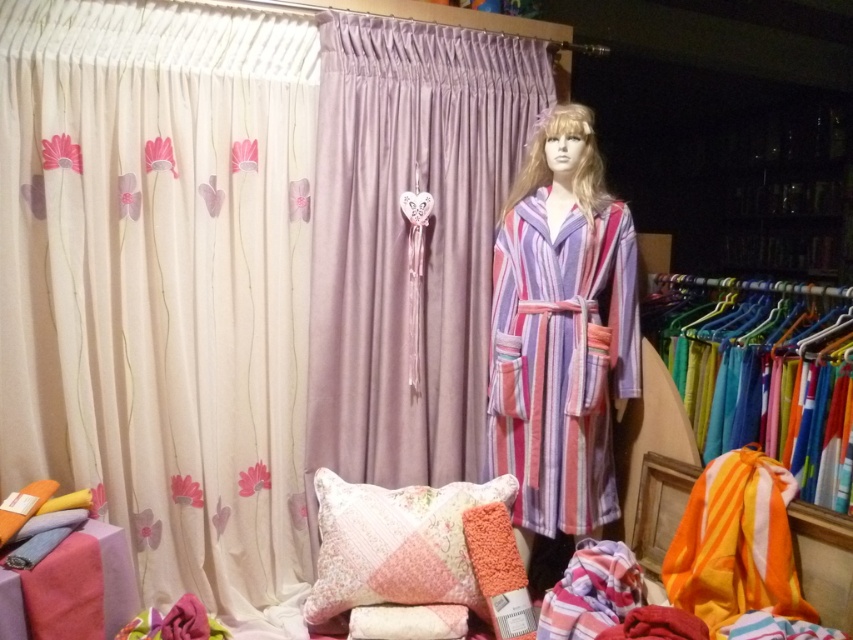
Describe the element at coordinates (407, 237) in the screenshot. Image resolution: width=853 pixels, height=640 pixels. I see `lavender satin curtain at center` at that location.

Is lavender satin curtain at center taller than fluffy pink pillow at center?

Yes, lavender satin curtain at center is taller than fluffy pink pillow at center.

Between point (436, 108) and point (456, 577), which one is positioned behind?

Point (436, 108)

I want to click on lavender satin curtain at center, so click(x=407, y=237).

Does creamy satin curtain at left have a lesser height compared to striped fabric robe at center?

Incorrect, creamy satin curtain at left's height does not fall short of striped fabric robe at center's.

Between creamy satin curtain at left and striped fabric robe at center, which one has more height?

creamy satin curtain at left

Is point (218, 502) positioned behind point (579, 106)?

Yes, point (218, 502) is farther from viewer.

In order to click on creamy satin curtain at left in this screenshot , I will do `click(161, 285)`.

Can you confirm if creamy satin curtain at left is shorter than fluffy pink pillow at center?

In fact, creamy satin curtain at left may be taller than fluffy pink pillow at center.

Which is behind, point (198, 444) or point (397, 563)?

Point (198, 444)

Where is `creamy satin curtain at left`? The image size is (853, 640). creamy satin curtain at left is located at coordinates (161, 285).